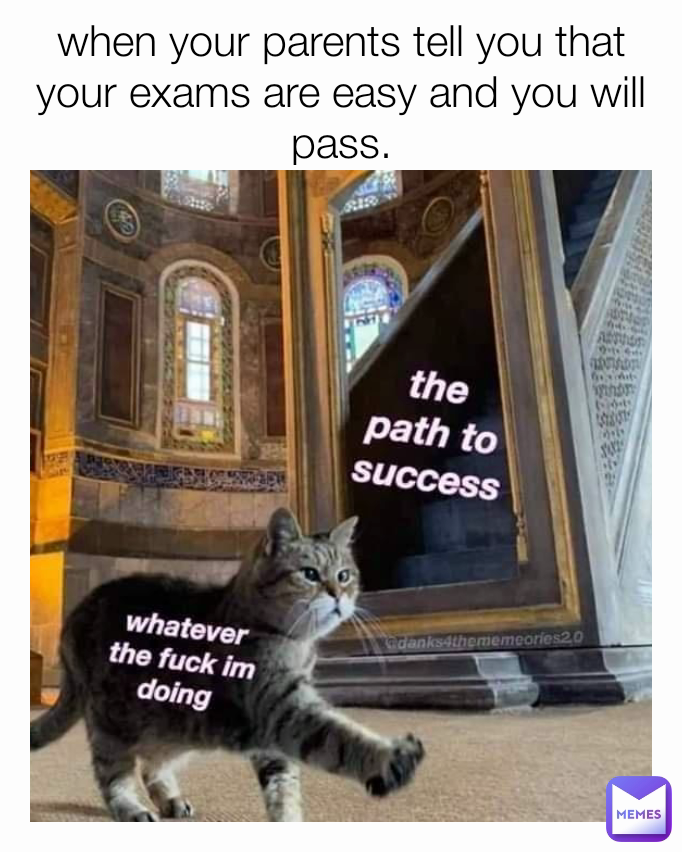
Identify the location of windows. The image size is (682, 852). (200, 173), (376, 183), (374, 320), (196, 354).